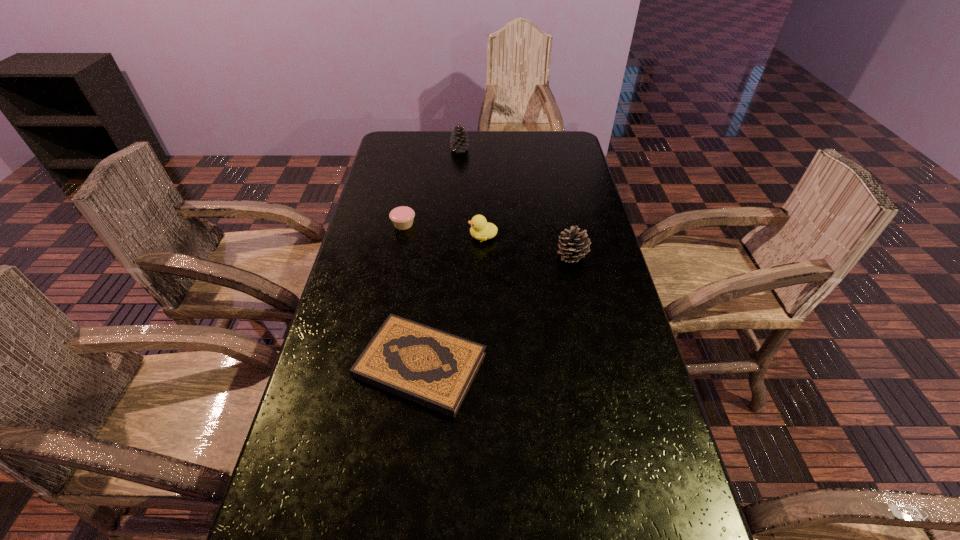
In the image, there is a desktop. Find the location of `vacant space at the left edge`. vacant space at the left edge is located at coordinates (342, 286).

In the image, there is a desktop. Where is `free space at the right edge`? The height and width of the screenshot is (540, 960). free space at the right edge is located at coordinates (624, 383).

Identify the location of blank area at the far left corner. The height and width of the screenshot is (540, 960). (422, 151).

The width and height of the screenshot is (960, 540). I want to click on free space at the far right corner of the desktop, so click(x=549, y=145).

Identify the location of vacant area that lies between the rightmost object and the hardback book. This screenshot has width=960, height=540. 496,311.

This screenshot has height=540, width=960. Identify the location of vacant space that is in between the duckling and the nearest object. (452, 301).

Identify the location of empty location between the nearer pinecone and the farther pinecone. The height and width of the screenshot is (540, 960). (516, 202).

At what (x,y) coordinates should I click in order to perform the action: click on free space between the nearest object and the third shortest object. Please return your answer as a coordinate pair (x, y). This screenshot has width=960, height=540. Looking at the image, I should click on (452, 301).

Where is `free space between the left pinecone and the rightmost object`? This screenshot has width=960, height=540. free space between the left pinecone and the rightmost object is located at coordinates [x=516, y=202].

Where is `free space that is in between the right pinecone and the third tallest object`? Image resolution: width=960 pixels, height=540 pixels. free space that is in between the right pinecone and the third tallest object is located at coordinates (528, 246).